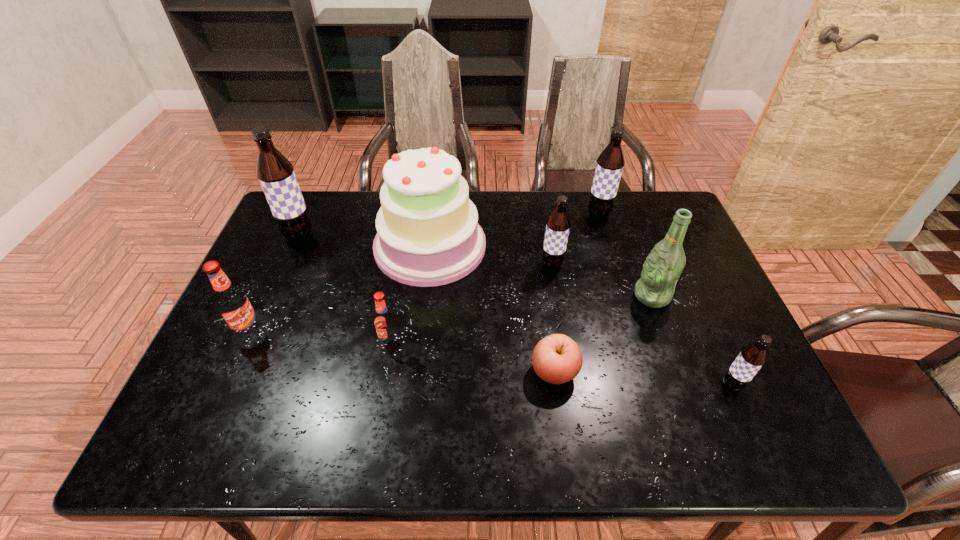
This screenshot has width=960, height=540. What are the coordinates of `blank area located on the surface of the beer bottle` in the screenshot? It's located at (528, 296).

Image resolution: width=960 pixels, height=540 pixels. In order to click on vacant point located on the right of the left red root beer in this screenshot , I will do `click(399, 332)`.

You are a GUI agent. You are given a task and a screenshot of the screen. Output one action in this format:
    pyautogui.click(x=<x>, y=<y>)
    Task: Click on the vacant region located 0.130m on the back of the fourth nearest root beer
    This screenshot has width=960, height=540.
    Given the screenshot: What is the action you would take?
    pyautogui.click(x=546, y=229)

The image size is (960, 540). What are the coordinates of `vacant space located on the front of the right red root beer` in the screenshot? It's located at (374, 433).

You are a GUI agent. You are given a task and a screenshot of the screen. Output one action in this format:
    pyautogui.click(x=<x>, y=<y>)
    Task: Click on the free space located 0.090m on the back of the smallest brown root beer
    
    Given the screenshot: What is the action you would take?
    pyautogui.click(x=713, y=344)

Find the location of a particular element. vacant space located 0.180m on the back of the apple is located at coordinates (544, 297).

Image resolution: width=960 pixels, height=540 pixels. What are the coordinates of `cake that is at the far edge` in the screenshot? It's located at (428, 234).

Where is `beer bottle present at the right edge`? The height and width of the screenshot is (540, 960). beer bottle present at the right edge is located at coordinates (663, 266).

At what (x,y) coordinates should I click in order to perform the action: click on root beer at the right edge. Please return your answer as a coordinate pair (x, y). Looking at the image, I should click on (751, 358).

Image resolution: width=960 pixels, height=540 pixels. What are the coordinates of `object present at the far left corner` in the screenshot? It's located at (275, 173).